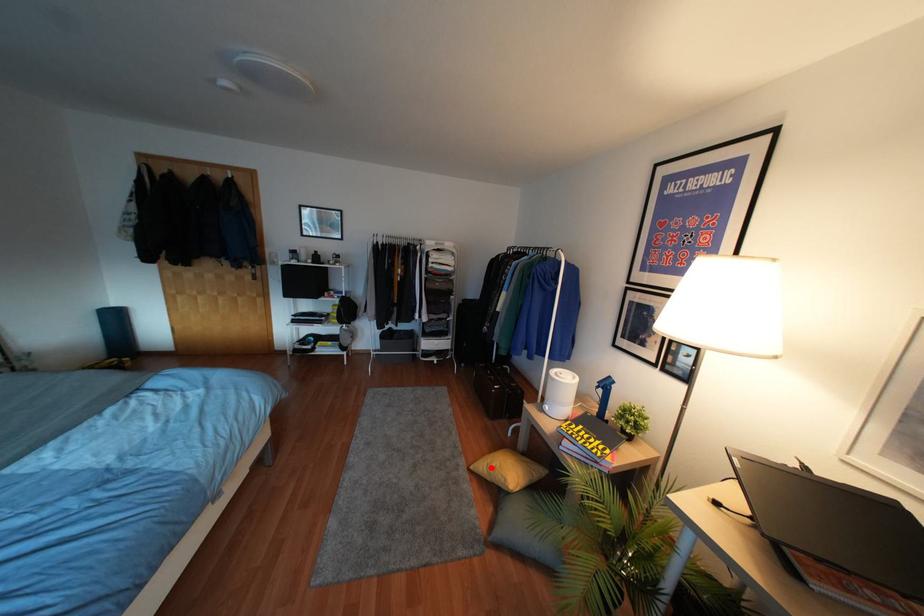
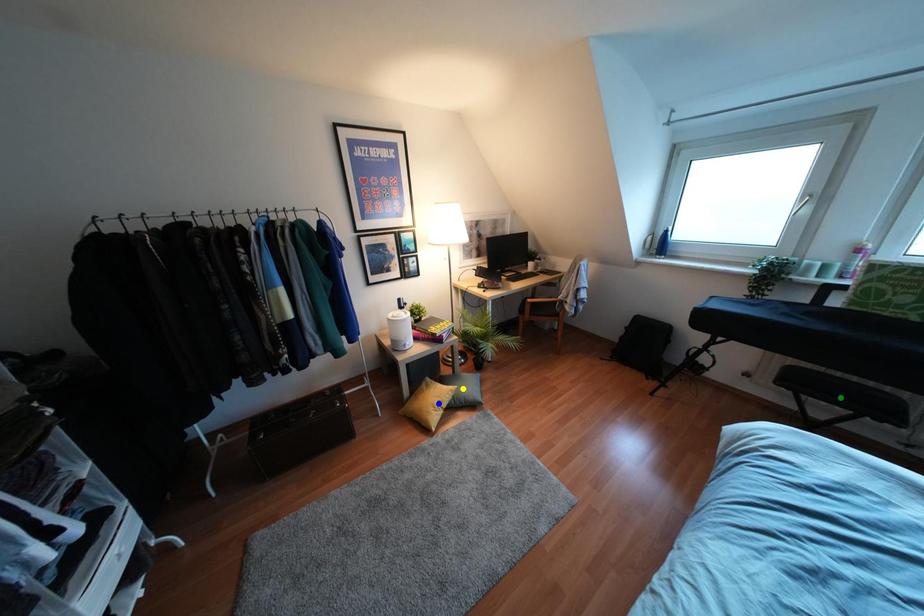
Question: I am providing you with two images of the same scene from different viewpoints. A red point is marked on the first image. You are given multiple points on the second image. Which spot in image 2 lines up with the point in image 1?

Choices:
 (A) green point
 (B) yellow point
 (C) blue point

Answer: (C)